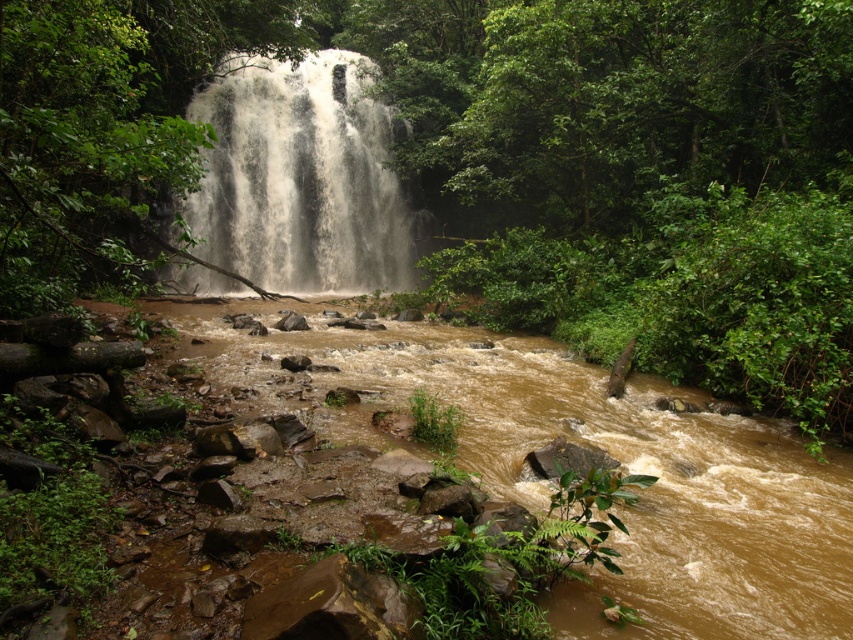
Consider the image. You are standing at the edge of the forest near the waterfall. You want to cross the river to the other side. The brown muddy stream at center is at point (601, 449). Is there a safe path to cross the river near that point?

The brown muddy stream at center is located at point (601, 449). Since the scene description mentions the riverbed is visible and composed of uneven rocks, there might be a path to cross near that point, but caution is advised due to the slippery and unstable terrain.

You are a hiker who wants to cross the river at the center of the forest scene. You see the brown muddy stream at center and the white frothy water at center. Which part of the river should you avoid stepping into to keep your boots dry?

You should avoid stepping into the white frothy water at center because it is frothy and likely deeper or faster flowing, making it riskier for keeping boots dry. The brown muddy stream at center might be shallower and safer for crossing.